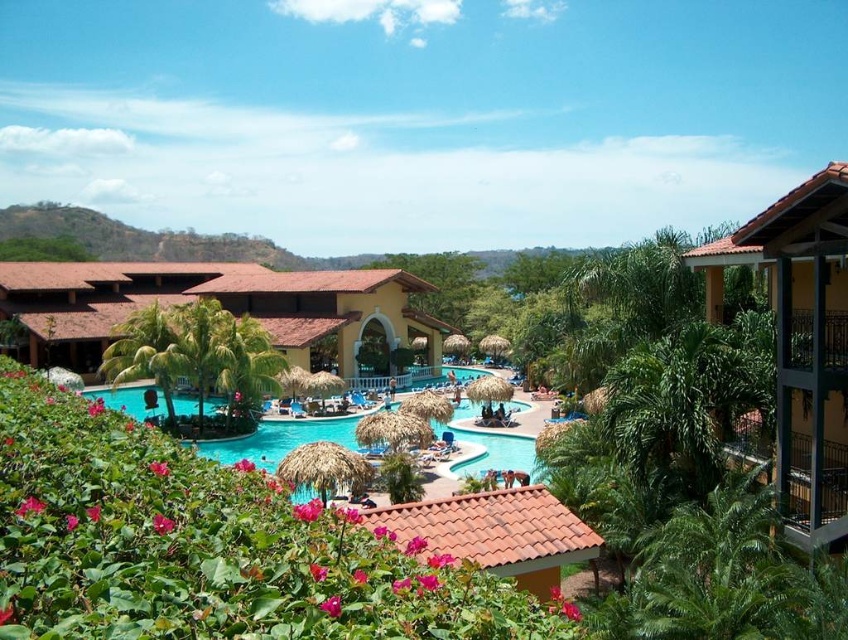
Between yellow stucco balcony at upper right and turquoise glossy water at center, which one has more height?

With more height is yellow stucco balcony at upper right.

Is yellow stucco balcony at upper right above turquoise glossy water at center?

Yes.

Describe the element at coordinates (801, 342) in the screenshot. I see `yellow stucco balcony at upper right` at that location.

Where is `yellow stucco balcony at upper right`? Image resolution: width=848 pixels, height=640 pixels. yellow stucco balcony at upper right is located at coordinates (801, 342).

Does matte yellow building at center have a smaller size compared to turquoise glossy water at center?

Actually, matte yellow building at center might be larger than turquoise glossy water at center.

Is matte yellow building at center taller than turquoise glossy water at center?

Correct, matte yellow building at center is much taller as turquoise glossy water at center.

Between point (106, 312) and point (303, 493), which one is positioned behind?

The point (106, 312) is behind.

This screenshot has width=848, height=640. Identify the location of matte yellow building at center. (227, 308).

Does matte yellow building at center lie in front of yellow stucco balcony at upper right?

No.

Between matte yellow building at center and yellow stucco balcony at upper right, which one is positioned lower?

yellow stucco balcony at upper right

Locate an element on the screen. matte yellow building at center is located at coordinates (227, 308).